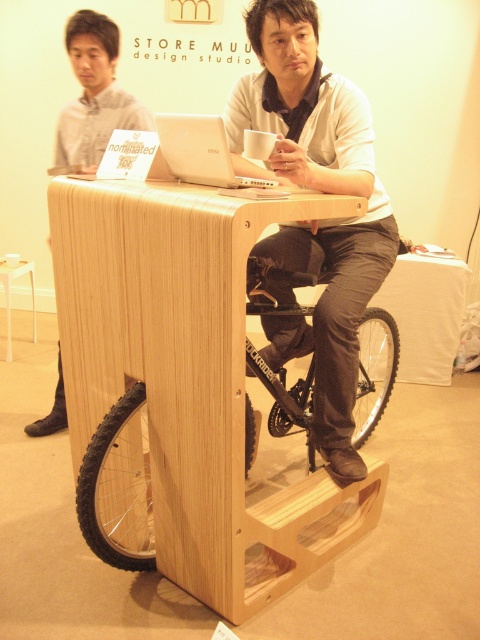
You are organizing a workspace and need to position the light wood table at center and the matte wood bike at center. According to the scene, which object is on the left side?

The matte wood bike at center is on the left side because the light wood table at center is to the right of it.

You are organizing a small event in this space and need to place a large plant between the matte wood bike at center and the white wood stool at lower left. Considering their sizes, which object should the plant be closer to?

The matte wood bike at center is bigger than the white wood stool at lower left, so the plant should be placed closer to the white wood stool at lower left to balance the space.

You are organizing a small event in the room and need to place a 1.5 meter long banner between the light wood table at center and the white wood stool at lower left. Can the banner fit horizontally between them?

The light wood table at center is wider than the white wood stool at lower left. However, the banner requires horizontal space between them, not their widths. The description only provides information about their widths, not the distance between them. Therefore, it is impossible to determine if the banner will fit based on the given details.